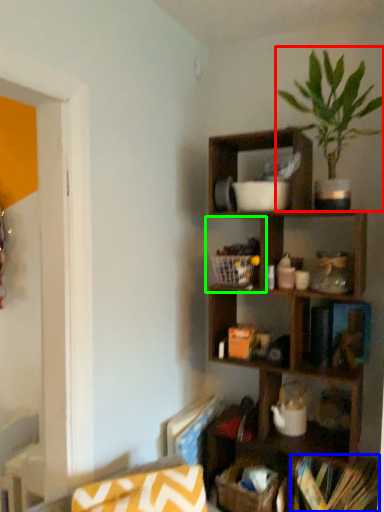
Question: Which object is the closest to the houseplant (highlighted by a red box)? Choose among these: book (highlighted by a blue box) or cabinet (highlighted by a green box).

Choices:
 (A) book
 (B) cabinet

Answer: (B)